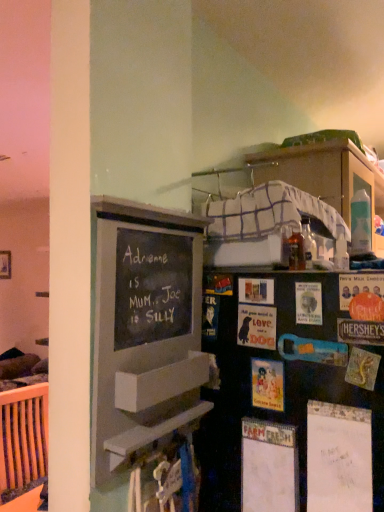
Question: Is chalkboard paint bulletin board at left not near matte cardboard postcard at right, which is counted as the first postcard, starting from the right?

Choices:
 (A) yes
 (B) no

Answer: (B)

Question: Can you confirm if chalkboard paint bulletin board at left is taller than matte cardboard postcard at right, which is counted as the first postcard, starting from the right?

Choices:
 (A) no
 (B) yes

Answer: (B)

Question: Does chalkboard paint bulletin board at left have a greater width compared to matte cardboard postcard at right, which is counted as the first postcard, starting from the right?

Choices:
 (A) yes
 (B) no

Answer: (A)

Question: Is chalkboard paint bulletin board at left to the right of matte cardboard postcard at right, which is counted as the first postcard, starting from the right, from the viewer's perspective?

Choices:
 (A) no
 (B) yes

Answer: (A)

Question: Considering the relative sizes of chalkboard paint bulletin board at left and matte cardboard postcard at right, which is counted as the first postcard, starting from the right, in the image provided, is chalkboard paint bulletin board at left thinner than matte cardboard postcard at right, which is counted as the first postcard, starting from the right,?

Choices:
 (A) no
 (B) yes

Answer: (A)

Question: Does point (251, 389) appear closer or farther from the camera than point (350, 280)?

Choices:
 (A) closer
 (B) farther

Answer: (B)

Question: Is matte paper postcard at center, positioned as the 2th postcard in left-to-right order, in front of or behind matte cardboard postcard at right, which is the fourth postcard from left to right, in the image?

Choices:
 (A) behind
 (B) front

Answer: (A)

Question: From the image's perspective, is matte paper postcard at center, which appears as the 3th postcard when viewed from the right, positioned above or below matte cardboard postcard at right, which is counted as the first postcard, starting from the right?

Choices:
 (A) below
 (B) above

Answer: (A)

Question: Considering the positions of matte paper postcard at center, which appears as the 3th postcard when viewed from the right, and matte cardboard postcard at right, which is the fourth postcard from left to right, in the image, is matte paper postcard at center, which appears as the 3th postcard when viewed from the right, taller or shorter than matte cardboard postcard at right, which is the fourth postcard from left to right,?

Choices:
 (A) short
 (B) tall

Answer: (B)

Question: From a real-world perspective, is matte paper postcard at center, positioned as the 2th postcard in left-to-right order, positioned above or below black matte bookshelf at center?

Choices:
 (A) above
 (B) below

Answer: (A)

Question: Relative to black matte bookshelf at center, is matte paper postcard at center, positioned as the 2th postcard in left-to-right order, in front or behind?

Choices:
 (A) front
 (B) behind

Answer: (B)

Question: Does point (258, 392) appear closer or farther from the camera than point (294, 349)?

Choices:
 (A) farther
 (B) closer

Answer: (A)

Question: Based on their sizes in the image, would you say matte paper postcard at center, positioned as the 2th postcard in left-to-right order, is bigger or smaller than black matte bookshelf at center?

Choices:
 (A) big
 (B) small

Answer: (B)

Question: In terms of size, does matte paper postcard at center, acting as the 4th postcard starting from the right, appear bigger or smaller than chalkboard paint bulletin board at left?

Choices:
 (A) small
 (B) big

Answer: (A)

Question: Is matte paper postcard at center, acting as the 4th postcard starting from the right, to the left or to the right of chalkboard paint bulletin board at left in the image?

Choices:
 (A) left
 (B) right

Answer: (B)